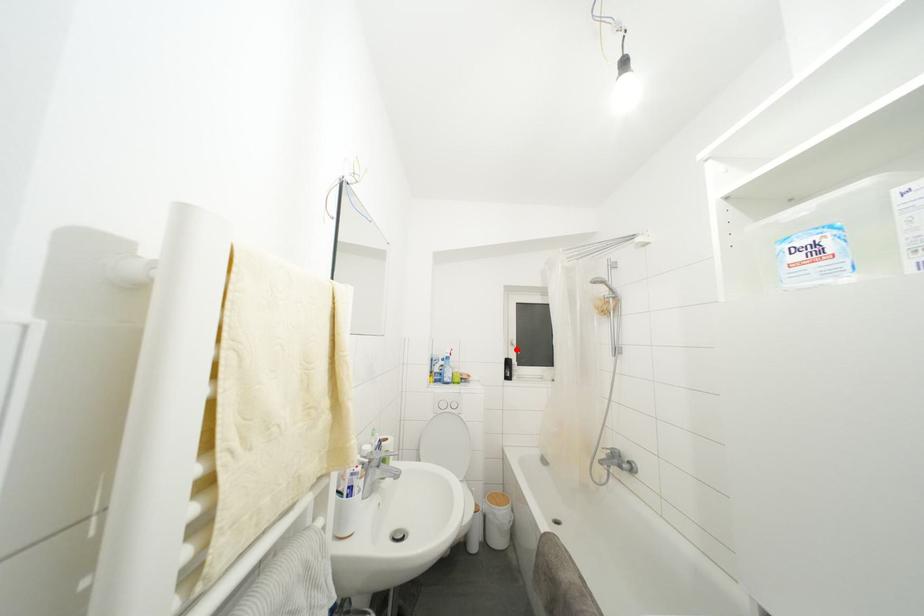
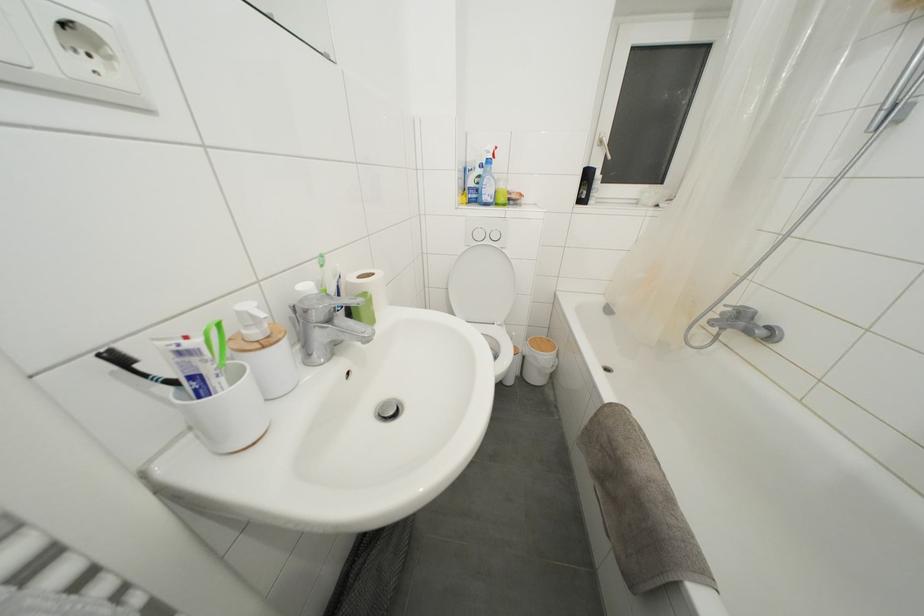
Question: I am providing you with two images of the same scene from different viewpoints. A red point is shown in image1. For the corresponding object point in image2, is it positioned nearer or farther from the camera?

Choices:
 (A) Nearer
 (B) Farther

Answer: (A)